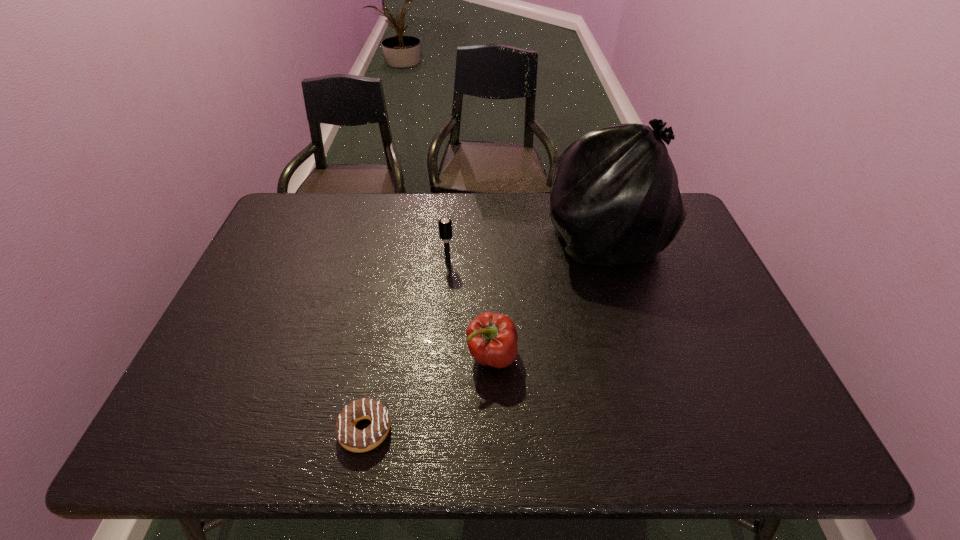
The height and width of the screenshot is (540, 960). What are the coordinates of `free location that satisfies the following two spatial constraints: 1. on the back side of the tallest object; 2. on the left side of the nearest object` in the screenshot? It's located at (402, 238).

Image resolution: width=960 pixels, height=540 pixels. Find the location of `free space that satisfies the following two spatial constraints: 1. on the front side of the bell pepper; 2. on the right side of the hairbrush`. free space that satisfies the following two spatial constraints: 1. on the front side of the bell pepper; 2. on the right side of the hairbrush is located at coordinates (441, 356).